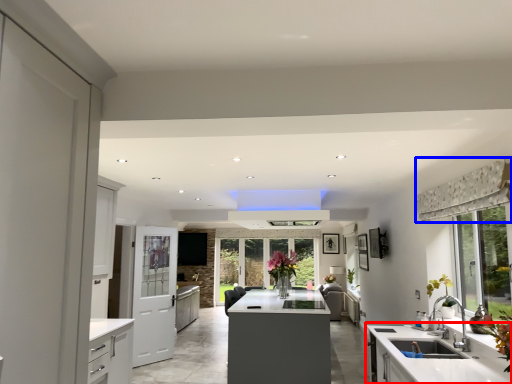
Question: Among these objects, which one is farthest to the camera, countertop (highlighted by a red box) or curtain (highlighted by a blue box)?

Choices:
 (A) countertop
 (B) curtain

Answer: (A)